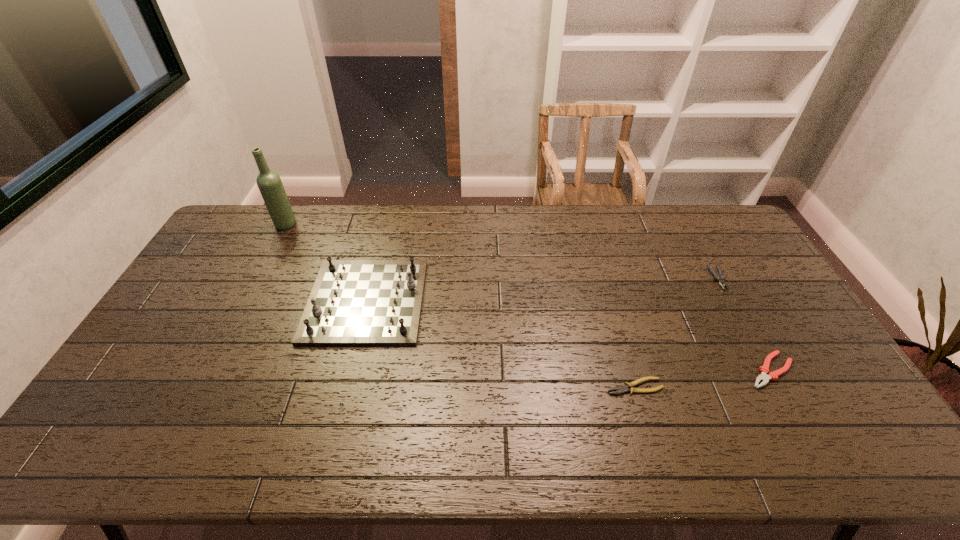
Locate an element on the screen. This screenshot has height=540, width=960. free space located 0.270m on the back of the shortest object is located at coordinates (611, 304).

Identify the location of object that is at the far edge. Image resolution: width=960 pixels, height=540 pixels. pos(269,183).

The image size is (960, 540). I want to click on free point at the far edge, so click(x=597, y=226).

At what (x,y) coordinates should I click in order to perform the action: click on vacant space at the near edge. Please return your answer as a coordinate pair (x, y). The width and height of the screenshot is (960, 540). Looking at the image, I should click on (302, 461).

Where is `vacant space at the right edge`? This screenshot has height=540, width=960. vacant space at the right edge is located at coordinates (742, 276).

Locate an element on the screen. Image resolution: width=960 pixels, height=540 pixels. free space at the far left corner of the desktop is located at coordinates (228, 222).

Where is `free spot between the shortest pliers and the wine bottle`? free spot between the shortest pliers and the wine bottle is located at coordinates (460, 306).

At what (x,y) coordinates should I click in order to perform the action: click on blank region between the fourth object from right to left and the farthest pliers. Please return your answer as a coordinate pair (x, y). Image resolution: width=960 pixels, height=540 pixels. Looking at the image, I should click on (542, 289).

The height and width of the screenshot is (540, 960). What are the coordinates of `vacant space that is in between the leftmost object and the shortest object` in the screenshot? It's located at (460, 306).

Where is `vacant space in between the third object from right to left and the chessboard`? This screenshot has width=960, height=540. vacant space in between the third object from right to left and the chessboard is located at coordinates (500, 343).